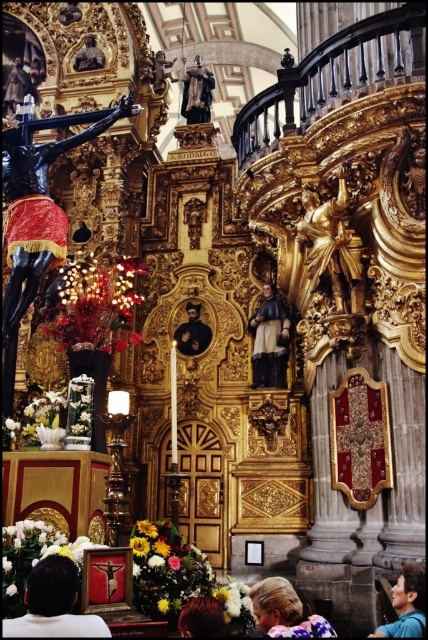
You are an art conservator assessing the statues in the church. You need to determine which statue has a greater width between the matte black statue at center and the smooth gold statue at upper center. Which one is wider?

The matte black statue at center is wider than the smooth gold statue at upper center according to the description.

You are standing in the church and want to take a photo of the matte black statue at center. Based on its position, where should you stand to ensure it is centered in your camera viewfinder?

The matte black statue at center is located at point coordinates, so you should position yourself directly in front of it to ensure it is centered in your camera viewfinder.

In the scene shown: You are standing in the church and want to locate the polished bronze statue at upper center. According to the coordinates given, where would you look relative to the central statue of Saint Rodriguez?

The polished bronze statue at upper center is located at coordinates point (x=196, y=92), which is to the upper left of the central statue of Saint Rodriguez.